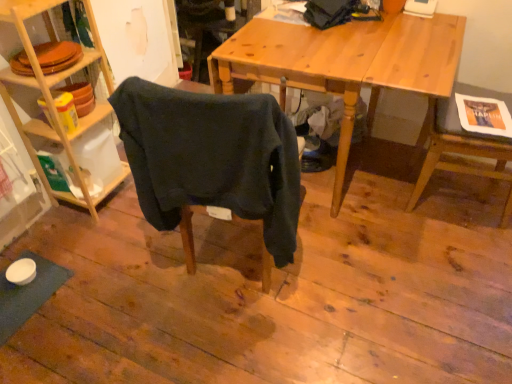
Question: From the image's perspective, is woodenshelves at left below dark blue fabric chair at center, marked as the first chair in a left-to-right arrangement?

Choices:
 (A) no
 (B) yes

Answer: (A)

Question: Could you tell me if woodenshelves at left is turned towards dark blue fabric chair at center, the 2th chair positioned from the right?

Choices:
 (A) no
 (B) yes

Answer: (B)

Question: From a real-world perspective, is woodenshelves at left on dark blue fabric chair at center, marked as the first chair in a left-to-right arrangement?

Choices:
 (A) no
 (B) yes

Answer: (A)

Question: Is woodenshelves at left positioned with its back to dark blue fabric chair at center, marked as the first chair in a left-to-right arrangement?

Choices:
 (A) yes
 (B) no

Answer: (B)

Question: Considering the relative sizes of woodenshelves at left and dark blue fabric chair at center, marked as the first chair in a left-to-right arrangement, in the image provided, is woodenshelves at left thinner than dark blue fabric chair at center, marked as the first chair in a left-to-right arrangement,?

Choices:
 (A) yes
 (B) no

Answer: (B)

Question: Is woodenshelves at left positioned far away from dark blue fabric chair at center, the 2th chair positioned from the right?

Choices:
 (A) no
 (B) yes

Answer: (A)

Question: From a real-world perspective, is dark blue fabric chair at center, marked as the first chair in a left-to-right arrangement, beneath wooden desk at center?

Choices:
 (A) no
 (B) yes

Answer: (A)

Question: Is dark blue fabric chair at center, marked as the first chair in a left-to-right arrangement, with wooden desk at center?

Choices:
 (A) no
 (B) yes

Answer: (A)

Question: Is dark blue fabric chair at center, the 2th chair positioned from the right, taller than wooden desk at center?

Choices:
 (A) no
 (B) yes

Answer: (A)

Question: Is dark blue fabric chair at center, marked as the first chair in a left-to-right arrangement, closer to camera compared to wooden desk at center?

Choices:
 (A) yes
 (B) no

Answer: (A)

Question: From a real-world perspective, is dark blue fabric chair at center, the 2th chair positioned from the right, located higher than wooden desk at center?

Choices:
 (A) no
 (B) yes

Answer: (B)

Question: From the image's perspective, is dark blue fabric chair at center, marked as the first chair in a left-to-right arrangement, below wooden desk at center?

Choices:
 (A) no
 (B) yes

Answer: (B)

Question: From a real-world perspective, does wooden desk at center sit lower than wooden chair at right, the first chair positioned from the right?

Choices:
 (A) yes
 (B) no

Answer: (A)